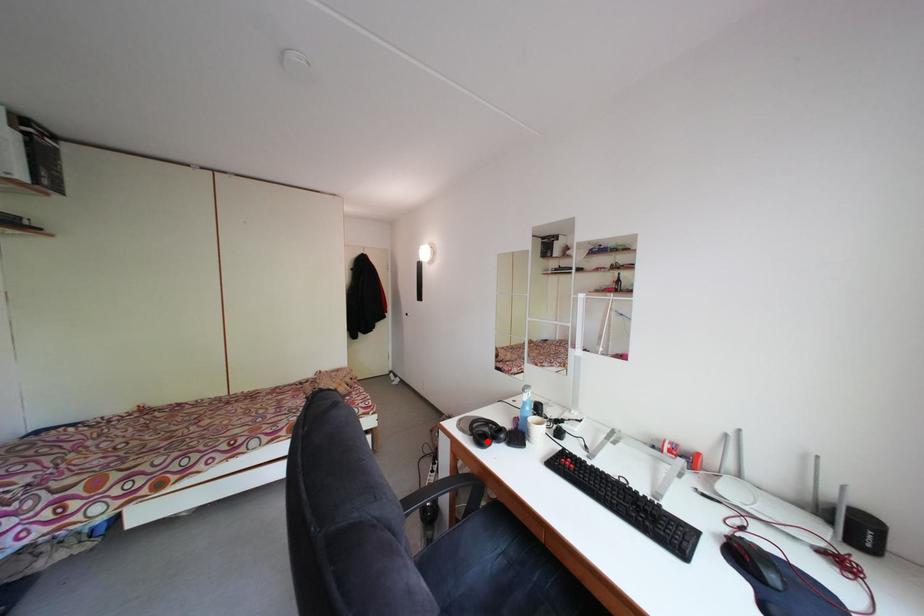
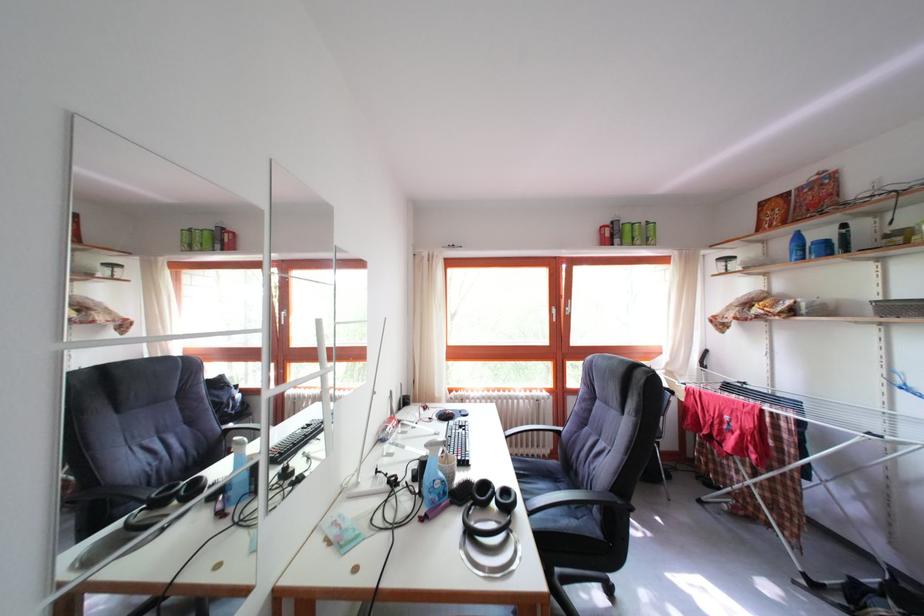
Find the pixel in the second image that matches the highlighted location in the first image.

(517, 506)